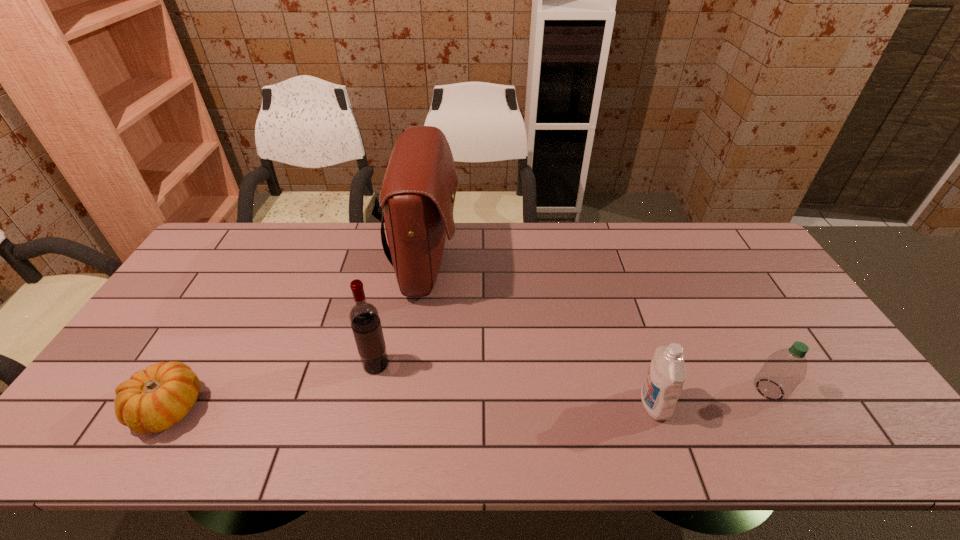
The image size is (960, 540). In order to click on vacant position at the near edge of the desktop in this screenshot , I will do `click(644, 444)`.

In the image, there is a desktop. Where is `vacant space at the left edge`? vacant space at the left edge is located at coordinates (142, 344).

This screenshot has height=540, width=960. I want to click on free region at the right edge of the desktop, so click(x=822, y=340).

The image size is (960, 540). I want to click on vacant space at the far right corner of the desktop, so click(709, 240).

Locate an element on the screen. vacant point located between the shortest object and the wine bottle is located at coordinates (272, 387).

Identify the location of vacant space that's between the satchel and the water bottle. The height and width of the screenshot is (540, 960). (598, 327).

Locate an element on the screen. The image size is (960, 540). free space between the rightmost object and the leftmost object is located at coordinates (468, 399).

You are a GUI agent. You are given a task and a screenshot of the screen. Output one action in this format:
    pyautogui.click(x=<x>, y=<y>)
    Task: Click on the vacant area that lies between the wine bottle and the shortest object
    
    Given the screenshot: What is the action you would take?
    pyautogui.click(x=272, y=387)

You are a GUI agent. You are given a task and a screenshot of the screen. Output one action in this format:
    pyautogui.click(x=<x>, y=<y>)
    Task: Click on the vacant area between the second tallest object and the shortest object
    The width and height of the screenshot is (960, 540).
    Given the screenshot: What is the action you would take?
    pyautogui.click(x=272, y=387)

Image resolution: width=960 pixels, height=540 pixels. In order to click on empty location between the rightmost object and the tallest object in this screenshot , I will do `click(598, 327)`.